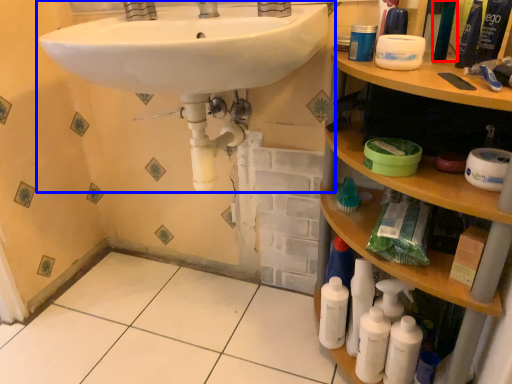
Question: Which point is closer to the camera, mouthwash (highlighted by a red box) or sink (highlighted by a blue box)?

Choices:
 (A) mouthwash
 (B) sink

Answer: (B)